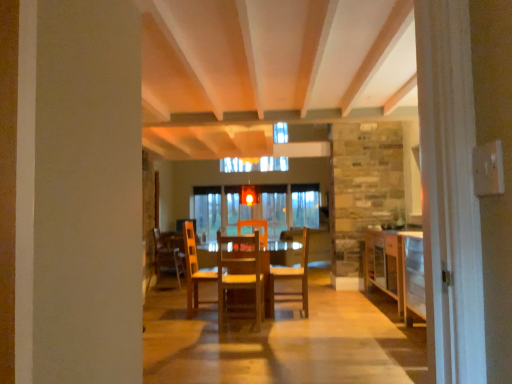
You are a GUI agent. You are given a task and a screenshot of the screen. Output one action in this format:
    pyautogui.click(x=<x>, y=<y>)
    Task: Click on the vacant area located to the right-hand side of wooden chair at center, the second chair in the right-to-left sequence
    The image size is (512, 384).
    Given the screenshot: What is the action you would take?
    pyautogui.click(x=281, y=320)